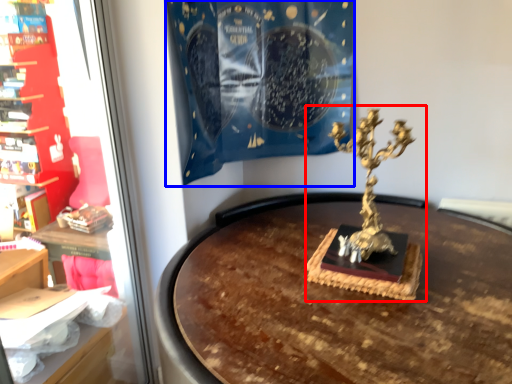
Question: Which point is closer to the camera, sculpture (highlighted by a red box) or curtain (highlighted by a blue box)?

Choices:
 (A) sculpture
 (B) curtain

Answer: (A)